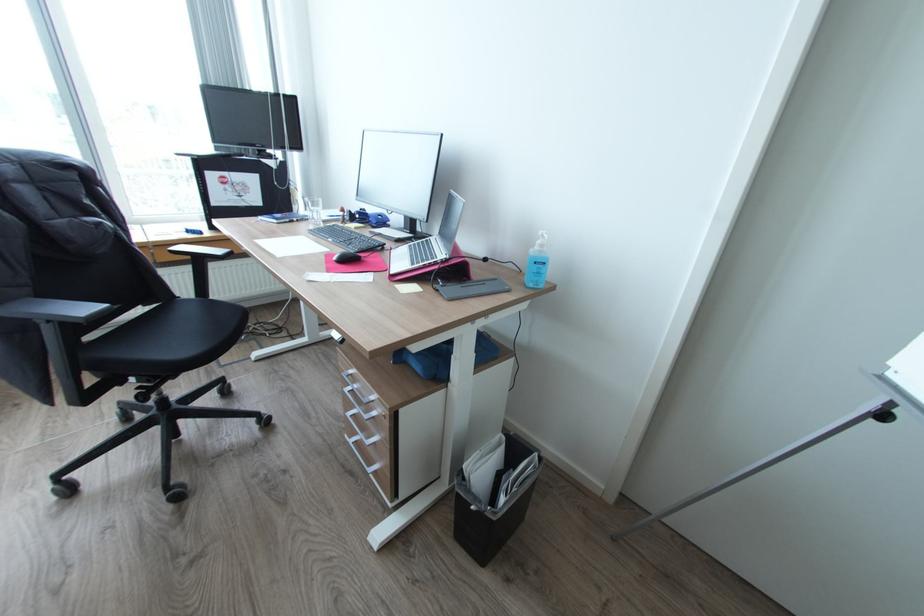
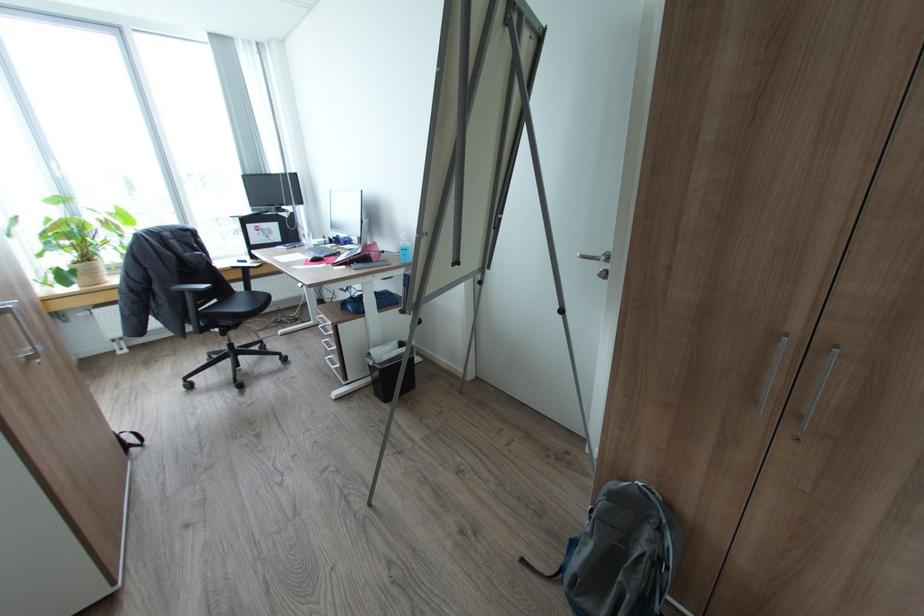
Find the pixel in the second image that matches [477,507] in the first image.

(374, 363)